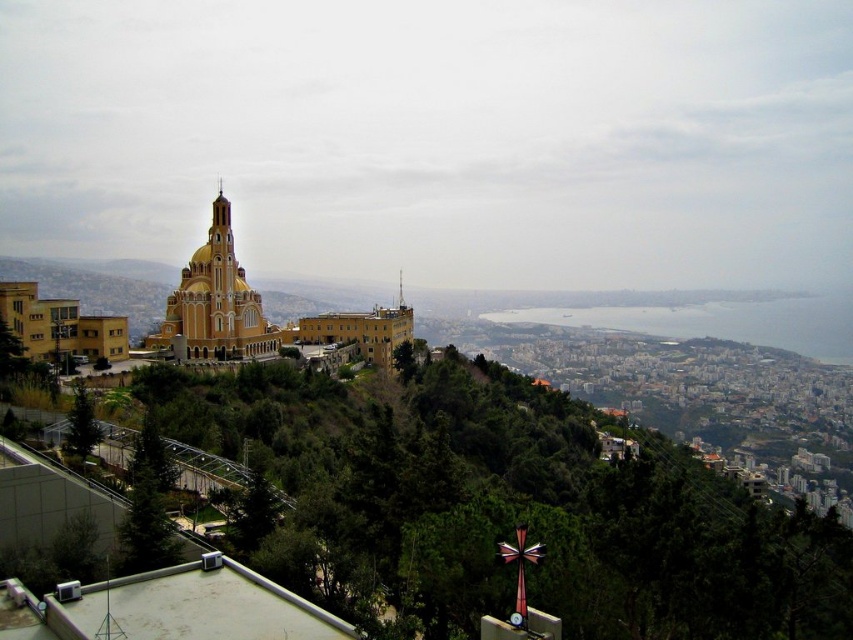
From the picture: Does gold metallic church at center have a lesser width compared to yellow matte building at center-left?

Yes.

Between gold metallic church at center and yellow matte building at center-left, which one appears on the left side from the viewer's perspective?

Positioned to the left is yellow matte building at center-left.

Where is `gold metallic church at center`? The width and height of the screenshot is (853, 640). gold metallic church at center is located at coordinates (215, 301).

Which of these two, gold metallic church at center or shiny gold spire at center, stands shorter?

With less height is shiny gold spire at center.

Can you confirm if gold metallic church at center is shorter than shiny gold spire at center?

Incorrect, gold metallic church at center's height does not fall short of shiny gold spire at center's.

The width and height of the screenshot is (853, 640). Describe the element at coordinates (215, 301) in the screenshot. I see `gold metallic church at center` at that location.

This screenshot has width=853, height=640. Identify the location of gold metallic church at center. (215, 301).

Is yellow matte building at center-left shorter than shiny gold spire at center?

In fact, yellow matte building at center-left may be taller than shiny gold spire at center.

Is yellow matte building at center-left positioned behind shiny gold spire at center?

No.

Where is `yellow matte building at center-left`? yellow matte building at center-left is located at coordinates [x=61, y=326].